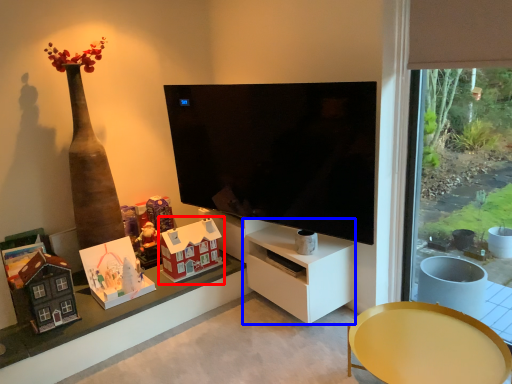
Question: Which point is further to the camera, toy (highlighted by a red box) or tv cabinet (highlighted by a blue box)?

Choices:
 (A) toy
 (B) tv cabinet

Answer: (A)